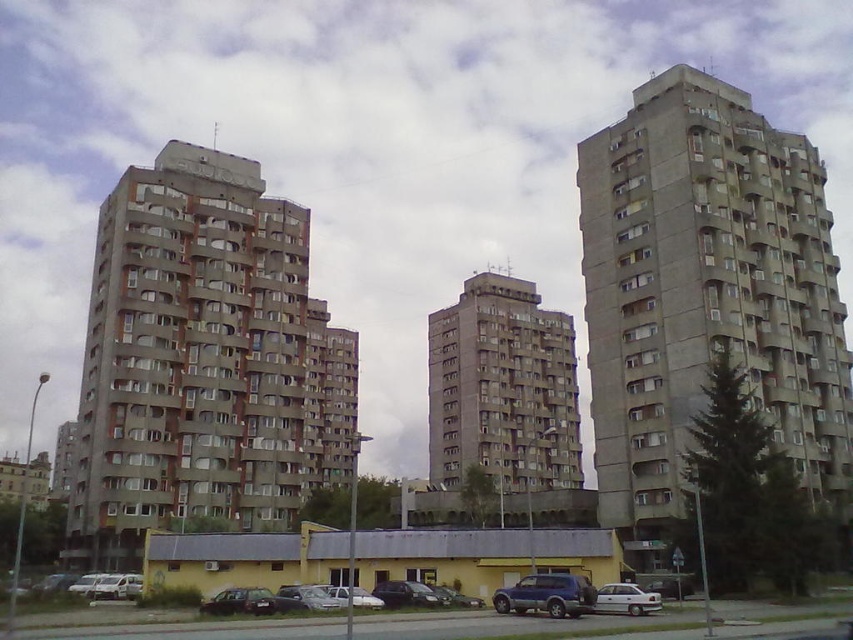
You are standing at the silver metallic car at lower left and want to walk to the entrance of the concrete building at center. The path is straight and unobstructed. If your walking speed is 1.5 meters per second, how many seconds will it take you to reach the entrance?

The concrete building at center is 42.96 meters away from the silver metallic car at lower left. At a walking speed of 1.5 meters per second, it will take approximately 28.64 seconds to reach the entrance. This is calculated by dividing the distance by the speed.

You are a delivery driver who needs to park your silver metallic car at lower left in the parking lot near the concrete building at center. Considering the size difference between them, will the car fit in the parking space next to the building?

The concrete building at center is larger in size than the silver metallic car at lower left, so the car should fit in the parking space next to the building since it is smaller than the building itself.